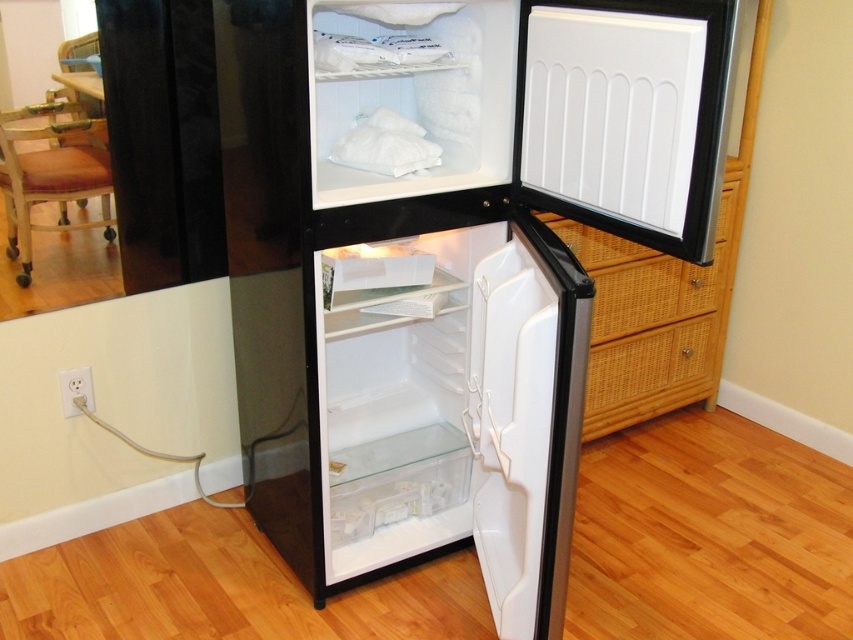
You are moving a 1.8 meter tall ladder into this kitchen. The ladder needs to be placed vertically against the wall behind the black glossy refrigerator at center and the white matte door at center. Considering their heights, which object will block the ladder from reaching the ceiling?

The black glossy refrigerator at center is much taller than the white matte door at center, so it will block the ladder from reaching the ceiling.

You are a delivery person holding a 3.5 feet long package and need to place it inside the black glossy refrigerator at center. The refrigerator door is open. Can you fit the package inside the refrigerator without bending it?

The distance between the black glossy refrigerator at center and the camera is 4.00 feet. Since the package is 3.5 feet long, it is shorter than the available space, so you can fit the package inside the refrigerator without bending it.

You are standing in the kitchen and want to place a new item on the black glossy refrigerator at center. The item requires a specific placement at coordinates point (445,260). Can you confirm if this coordinate is available on the refrigerator?

The point (445,260) corresponds to the black glossy refrigerator at center, so yes, the coordinate is available on the refrigerator.